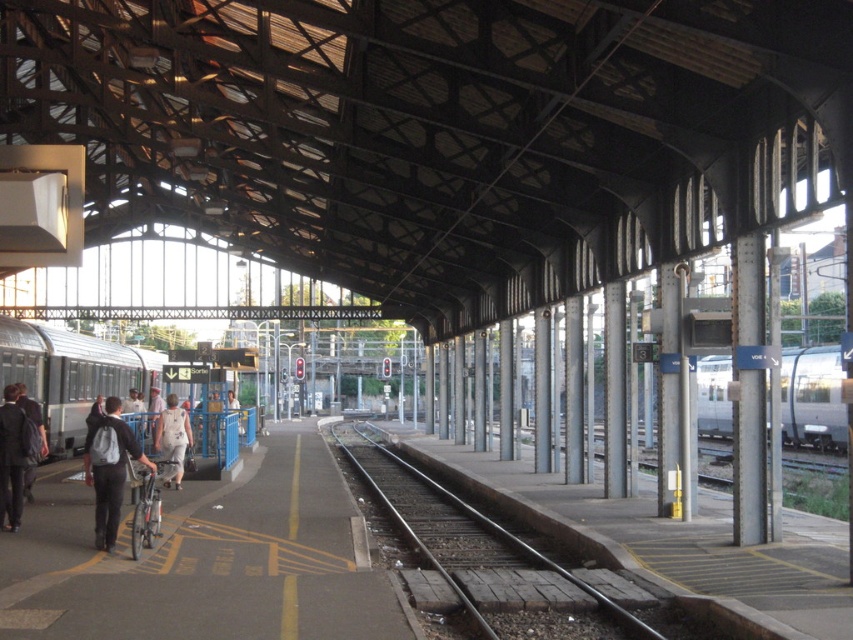
Question: Can you confirm if silver metallic train at left is positioned to the right of silver metallic train at right?

Choices:
 (A) yes
 (B) no

Answer: (B)

Question: Which point is farther to the camera?

Choices:
 (A) (166, 440)
 (B) (115, 429)
 (C) (796, 392)
 (D) (16, 522)

Answer: (C)

Question: Where is silver metallic train at left located in relation to dark gray backpack at left in the image?

Choices:
 (A) right
 (B) left

Answer: (B)

Question: Among these objects, which one is nearest to the camera?

Choices:
 (A) dark gray suit at left
 (B) silver metallic train at right

Answer: (B)

Question: Among these points, which one is nearest to the camera?

Choices:
 (A) (109, 422)
 (B) (172, 410)
 (C) (566, 628)

Answer: (C)

Question: From the image, what is the correct spatial relationship of silver metallic train at right in relation to dark gray backpack at left?

Choices:
 (A) below
 (B) above

Answer: (A)